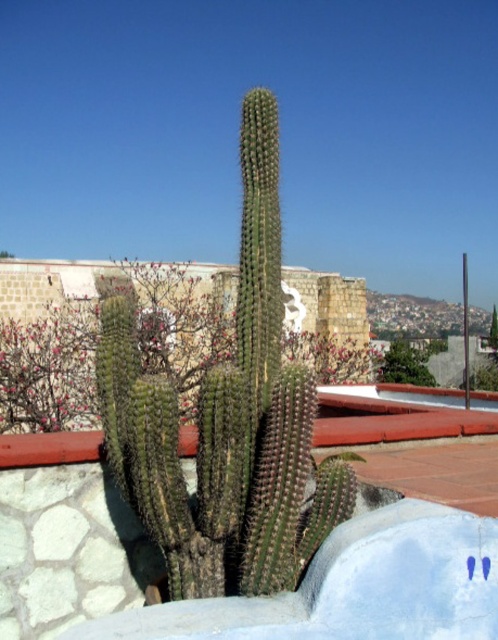
Does green spiny cactus at center appear on the right side of green spiky cactus at center?

In fact, green spiny cactus at center is to the left of green spiky cactus at center.

Is point (284, 369) positioned in front of point (431, 344)?

Yes, it is.

Find the location of `green spiny cactus at center`. green spiny cactus at center is located at coordinates (228, 420).